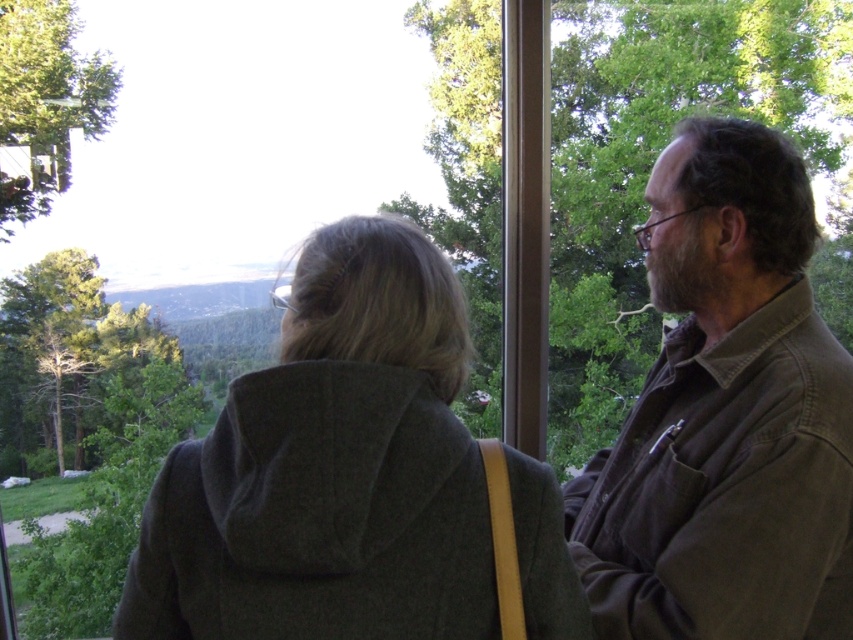
You are a drone operator trying to locate the dark gray wool hoodie at center. According to the coordinates given, where should you direct the drone to find it?

The dark gray wool hoodie at center is located at coordinates point (331, 468).

You are a delivery robot with a package that requires a 16 inch clearance to pass through. You need to navigate between the dark gray wool hoodie at center and the brown cotton shirt at right. Can you safely pass through the space between them?

The dark gray wool hoodie at center and the brown cotton shirt at right are 14.72 inches apart from each other, which is less than the required 16 inch clearance. Therefore, the delivery robot cannot safely pass through the space between them.

You are trying to decide which clothing item to take for a casual day out. Based on the image, which clothing item has a wider width between the dark gray wool hoodie at center and the brown cotton shirt at right?

The dark gray wool hoodie at center has a larger width than the brown cotton shirt at right according to the description.